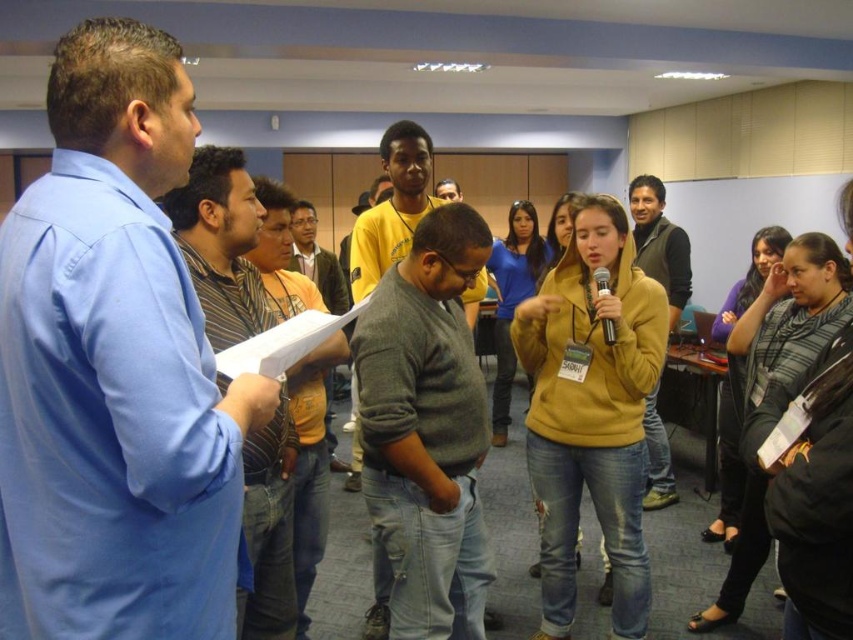
You are standing in the conference room and see the point marked at coordinates (590, 412). Which object from the scene does this point correspond to?

The point at coordinates (590, 412) is on the mustard yellow hoodie at center.

You are organizing a presentation and need to ensure that the mustard yellow hoodie at center and the black plastic microphone at center can both fit on a shelf that is 1 meter wide. Based on their sizes, will they both fit?

The mustard yellow hoodie at center is wider than the black plastic microphone at center, but since the shelf is 1 meter wide, both items can fit together as their combined width is likely less than 1 meter unless the hoodie is extremely large. However, without exact measurements, it is uncertain. Please check the actual sizes.